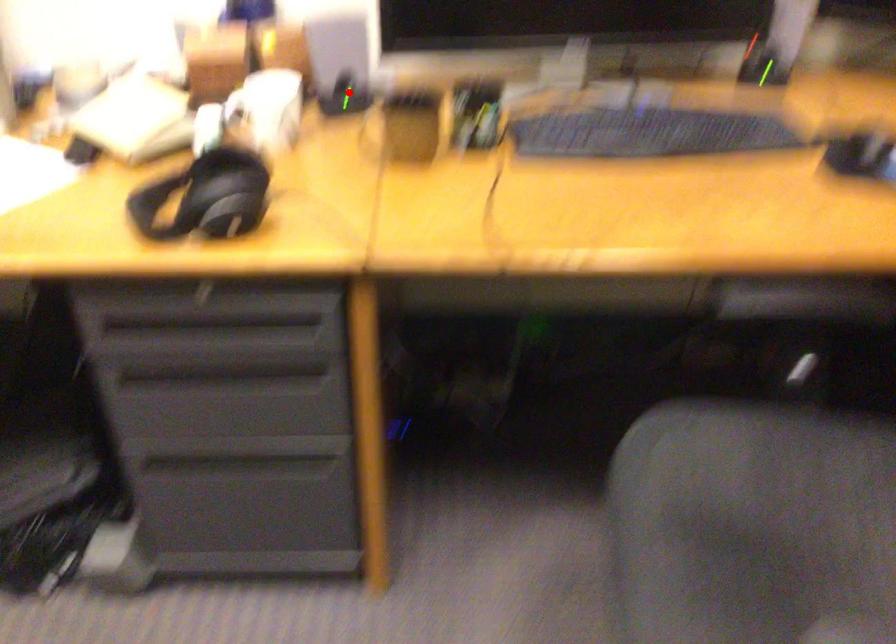
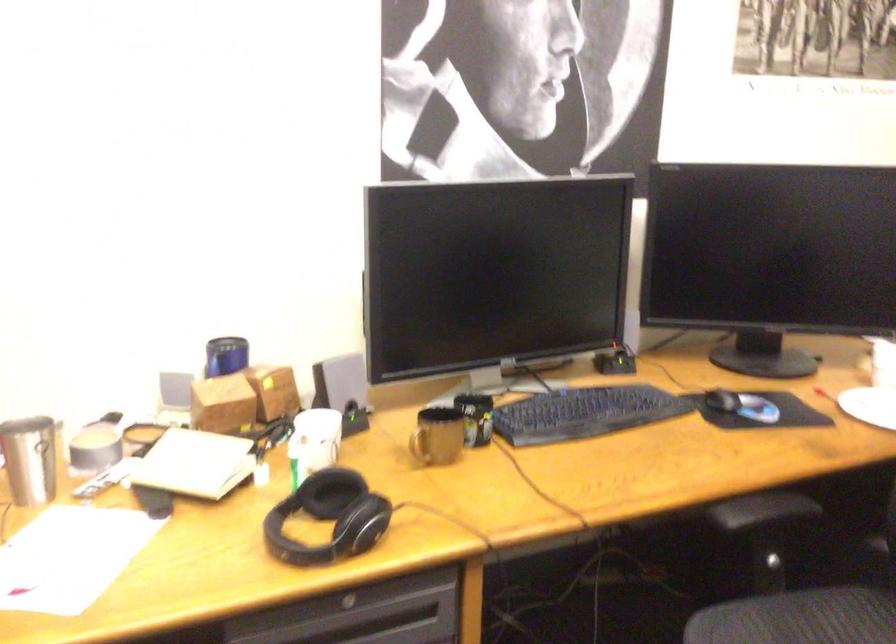
Question: I am providing you with two images of the same scene from different viewpoints. A red point is marked on the first image. At the location where the point appears in image 1, is it still visible in image 2?

Choices:
 (A) Yes
 (B) No

Answer: (A)